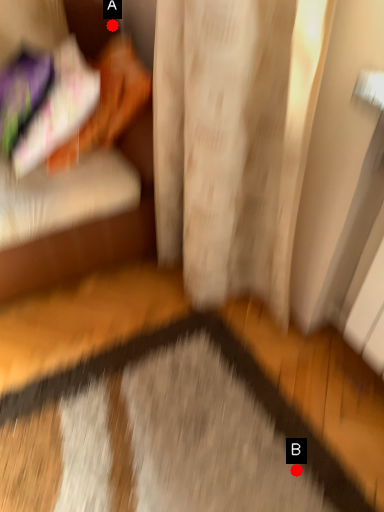
Question: Two points are circled on the image, labeled by A and B beside each circle. Among these points, which one is farthest from the camera?

Choices:
 (A) A is further
 (B) B is further

Answer: (A)